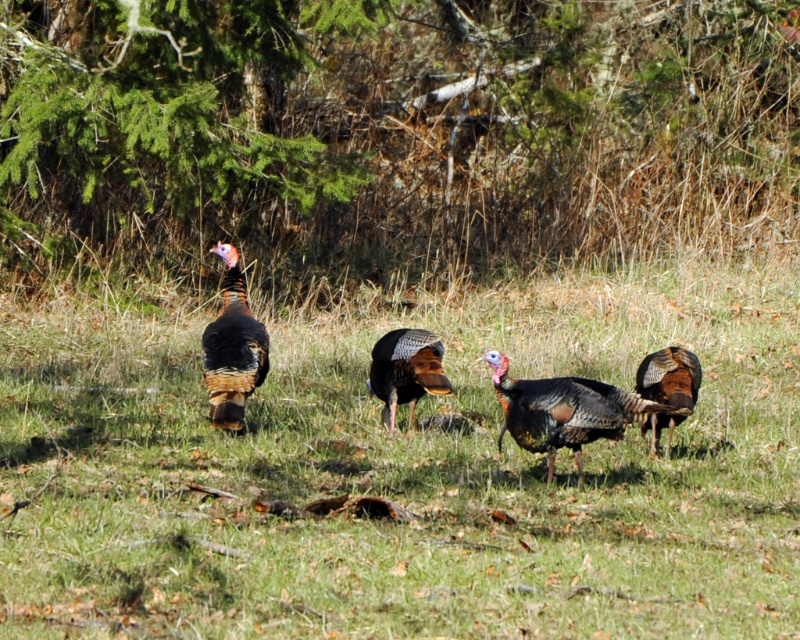
Question: Does shiny brown turkey at center appear on the right side of shiny brown turkey at right?

Choices:
 (A) no
 (B) yes

Answer: (A)

Question: Which point is closer to the camera taking this photo?

Choices:
 (A) (600, 426)
 (B) (214, 387)
 (C) (686, 397)
 (D) (162, 388)

Answer: (A)

Question: Does shiny brown turkey at center have a greater width compared to shiny metallic turkey at center?

Choices:
 (A) yes
 (B) no

Answer: (B)

Question: Does shiny metallic turkey at center have a smaller size compared to multicolored feathered turkey at center?

Choices:
 (A) no
 (B) yes

Answer: (A)

Question: Among these objects, which one is nearest to the camera?

Choices:
 (A) green grass at center
 (B) glossy iridescent turkey at center
 (C) shiny brown turkey at right

Answer: (B)

Question: Estimate the real-world distances between objects in this image. Which object is farther from the green grass at center?

Choices:
 (A) glossy iridescent turkey at center
 (B) multicolored feathered turkey at center

Answer: (A)